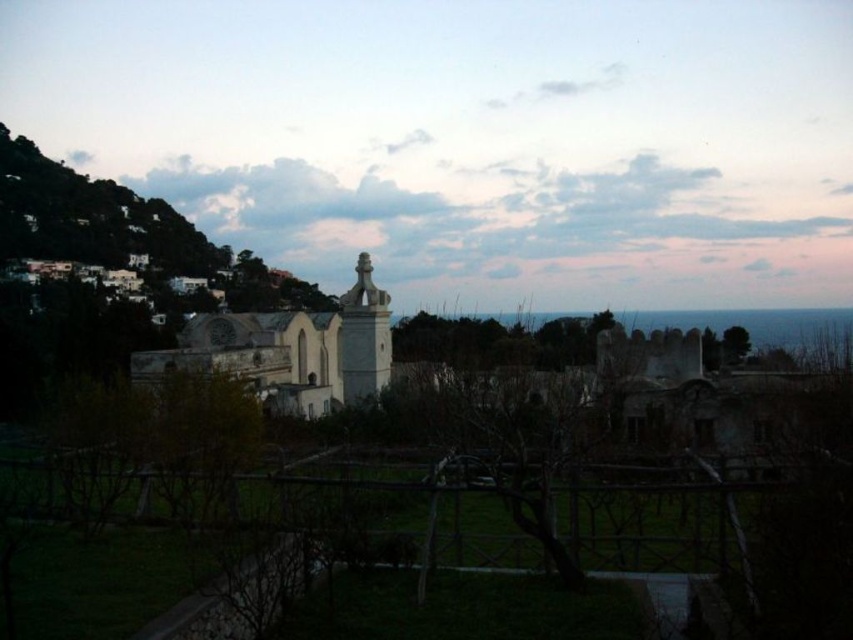
Can you confirm if white stone statue at center is positioned to the left of white stone church at center?

In fact, white stone statue at center is to the right of white stone church at center.

Who is higher up, white stone statue at center or white stone church at center?

white stone statue at center is above.

Between point (378, 234) and point (386, 385), which one is positioned behind?

The point (378, 234) is more distant.

The height and width of the screenshot is (640, 853). Find the location of `white stone statue at center`. white stone statue at center is located at coordinates (469, 138).